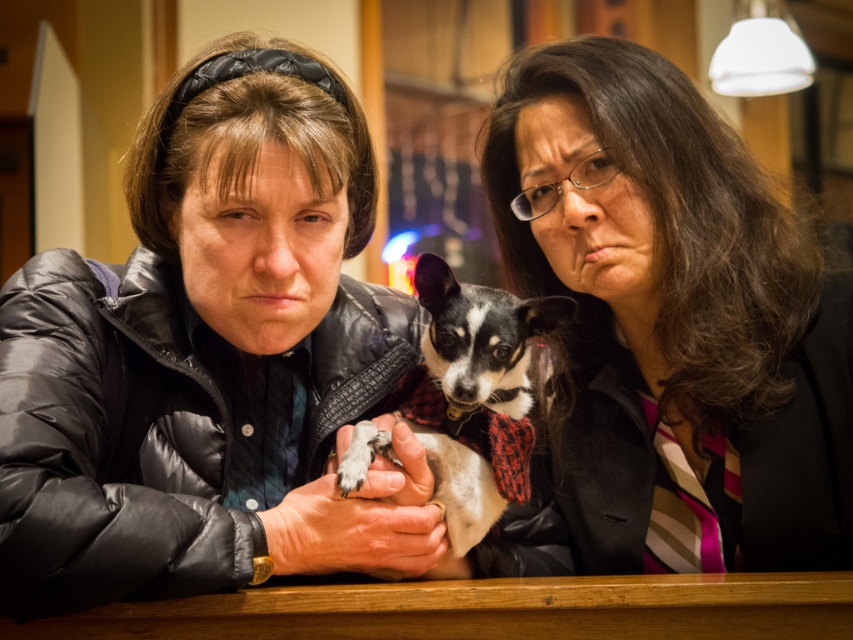
Question: Which object appears closest to the camera in this image?

Choices:
 (A) white and black fur at center
 (B) black quilted jacket at center
 (C) matte black jacket at center

Answer: (B)

Question: Based on their relative distances, which object is nearer to the matte black jacket at center?

Choices:
 (A) white and black fur at center
 (B) black quilted jacket at center

Answer: (A)

Question: Can you confirm if black quilted jacket at center is bigger than matte black jacket at center?

Choices:
 (A) no
 (B) yes

Answer: (B)

Question: Estimate the real-world distances between objects in this image. Which object is closer to the white and black fur at center?

Choices:
 (A) matte black jacket at center
 (B) black quilted jacket at center

Answer: (B)

Question: Does matte black jacket at center have a greater width compared to white and black fur at center?

Choices:
 (A) yes
 (B) no

Answer: (A)

Question: Considering the relative positions of matte black jacket at center and white and black fur at center in the image provided, where is matte black jacket at center located with respect to white and black fur at center?

Choices:
 (A) left
 (B) right

Answer: (B)